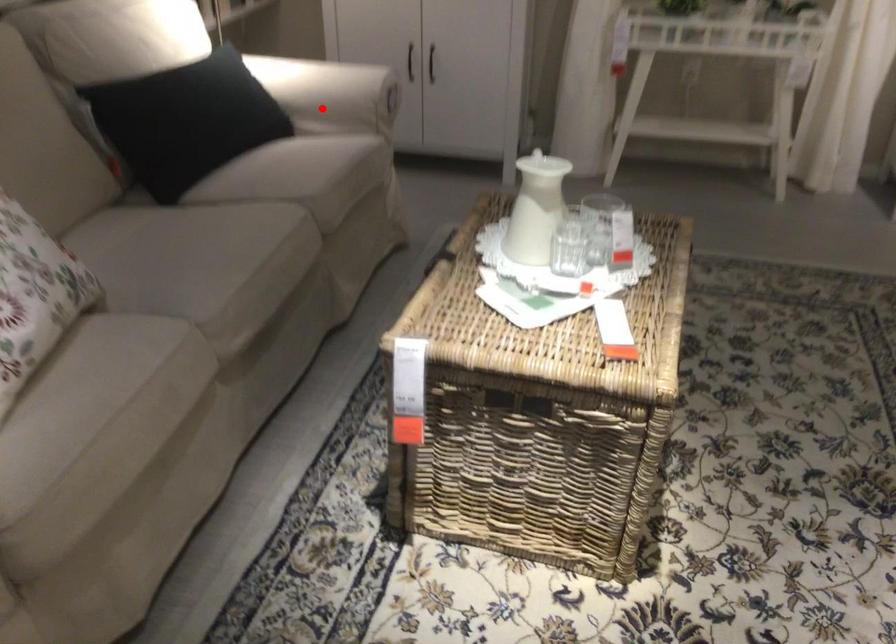
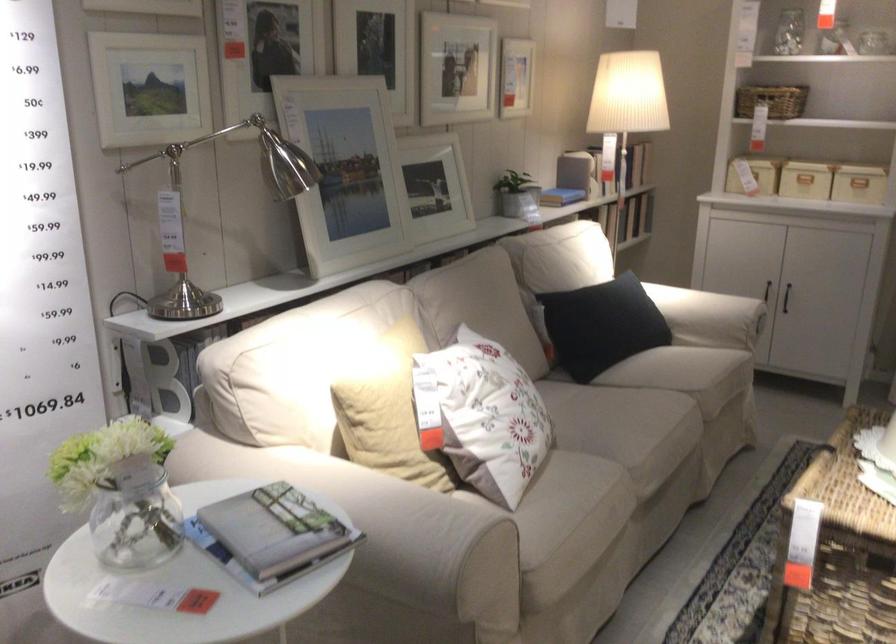
Locate, in the second image, the point that corresponds to the highlighted location in the first image.

(709, 317)